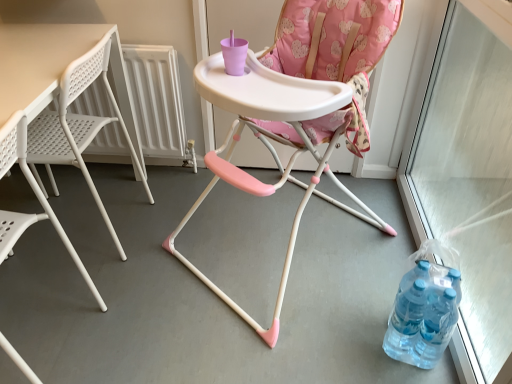
Identify the location of free space between pink plastic highchair at center, the 2th chair from the left, and white plastic table at left. The width and height of the screenshot is (512, 384). (165, 249).